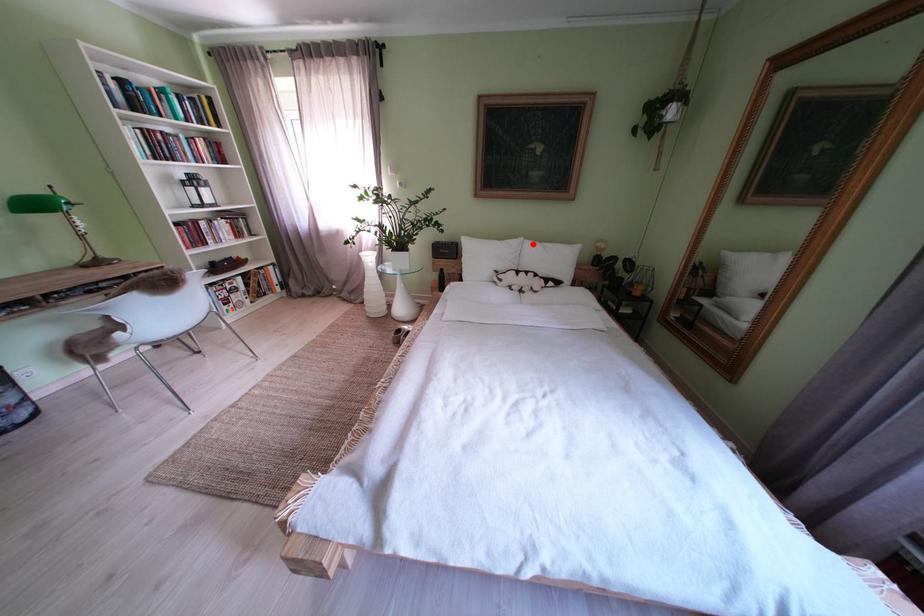
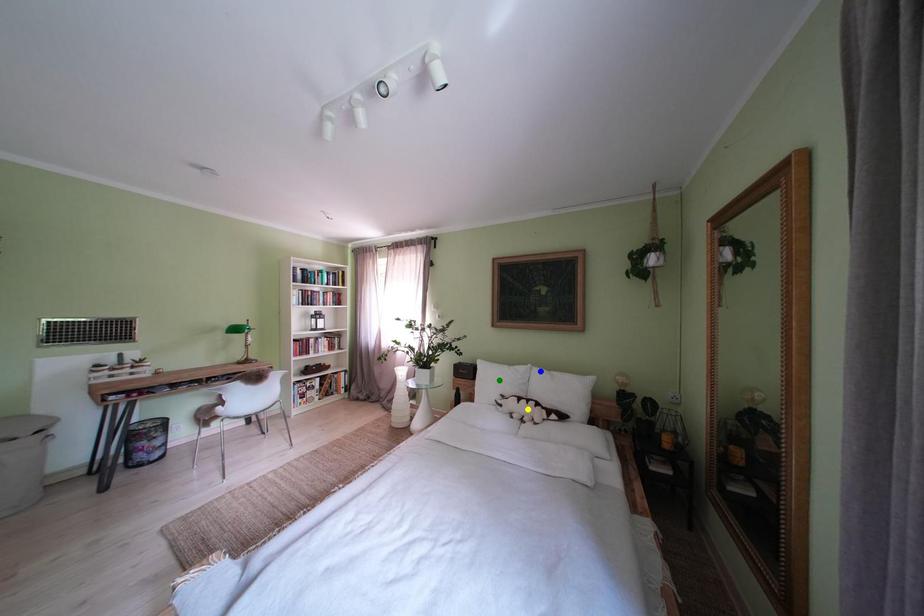
Question: I am providing you with two images of the same scene from different viewpoints. A red point is marked on the first image. You are given multiple points on the second image. Which spot in image 2 lines up with the point in image 1?

Choices:
 (A) green point
 (B) yellow point
 (C) blue point

Answer: (C)